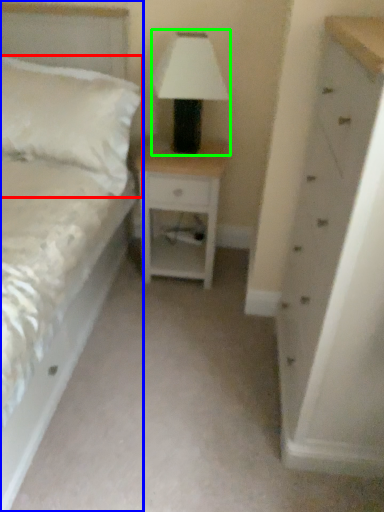
Question: Considering the real-world distances, which object is farthest from pillow (highlighted by a red box)? bed (highlighted by a blue box) or table lamp (highlighted by a green box)?

Choices:
 (A) bed
 (B) table lamp

Answer: (A)